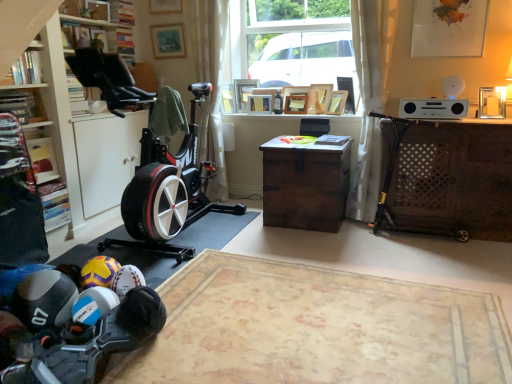
Question: From the image's perspective, is white sheer curtain at right, arranged as the first curtain when viewed from the right, under rubberized black shoe at lower left, the 1th toy when ordered from front to back?

Choices:
 (A) yes
 (B) no

Answer: (B)

Question: Is white sheer curtain at right, which ranks as the 2th curtain in left-to-right order, far from rubberized black shoe at lower left, arranged as the 2th toy when viewed from the back?

Choices:
 (A) no
 (B) yes

Answer: (B)

Question: Can you confirm if white sheer curtain at right, arranged as the first curtain when viewed from the right, is thinner than rubberized black shoe at lower left, arranged as the 2th toy when viewed from the back?

Choices:
 (A) no
 (B) yes

Answer: (A)

Question: Is white sheer curtain at right, arranged as the first curtain when viewed from the right, positioned behind rubberized black shoe at lower left, the 1th toy when ordered from front to back?

Choices:
 (A) yes
 (B) no

Answer: (A)

Question: From a real-world perspective, is white sheer curtain at right, arranged as the first curtain when viewed from the right, physically above rubberized black shoe at lower left, the 1th toy when ordered from front to back?

Choices:
 (A) yes
 (B) no

Answer: (A)

Question: Is white sheer curtain at right, which ranks as the 2th curtain in left-to-right order, taller or shorter than rubberized black dumbbells at lower left?

Choices:
 (A) tall
 (B) short

Answer: (A)

Question: Is point (354, 180) positioned closer to the camera than point (72, 301)?

Choices:
 (A) farther
 (B) closer

Answer: (A)

Question: From the image's perspective, is white sheer curtain at right, which ranks as the 2th curtain in left-to-right order, located above or below rubberized black dumbbells at lower left?

Choices:
 (A) above
 (B) below

Answer: (A)

Question: Is white sheer curtain at right, which ranks as the 2th curtain in left-to-right order, to the left or to the right of rubberized black dumbbells at lower left in the image?

Choices:
 (A) right
 (B) left

Answer: (A)

Question: Is wooden picture frame at upper center, acting as the third picture frame starting from the right, in front of or behind wooden picture frame at upper center, which appears as the 6th picture frame when viewed from the left, in the image?

Choices:
 (A) behind
 (B) front

Answer: (A)

Question: In terms of width, does wooden picture frame at upper center, which is the 5th picture frame in left-to-right order, look wider or thinner when compared to wooden picture frame at upper center, which appears as the 6th picture frame when viewed from the left?

Choices:
 (A) wide
 (B) thin

Answer: (A)

Question: Is wooden picture frame at upper center, which is the 5th picture frame in left-to-right order, bigger or smaller than wooden picture frame at upper center, which appears as the 6th picture frame when viewed from the left?

Choices:
 (A) small
 (B) big

Answer: (B)

Question: Considering the positions of point (329, 94) and point (345, 91), is point (329, 94) closer or farther from the camera than point (345, 91)?

Choices:
 (A) closer
 (B) farther

Answer: (B)

Question: Is wooden bookshelf at left, which appears as the 1th shelf when ordered from the bottom, to the left or to the right of brown wooden desk at center, positioned as the second desk in right-to-left order, in the image?

Choices:
 (A) right
 (B) left

Answer: (B)

Question: In the image, is wooden bookshelf at left, which appears as the 1th shelf when ordered from the bottom, positioned in front of or behind brown wooden desk at center, the 1th desk in the left-to-right sequence?

Choices:
 (A) behind
 (B) front

Answer: (B)